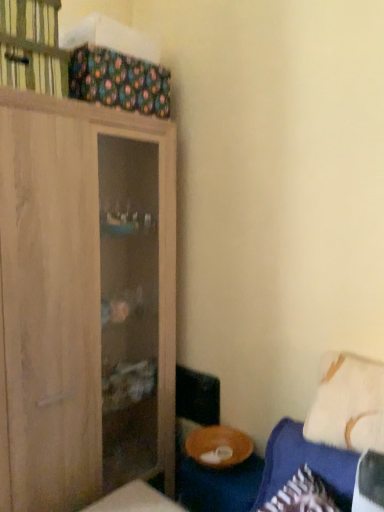
Question: Does white soft pillow at lower right have a greater width compared to wooden cabinet at upper left?

Choices:
 (A) yes
 (B) no

Answer: (B)

Question: Is white soft pillow at lower right positioned far away from wooden cabinet at upper left?

Choices:
 (A) yes
 (B) no

Answer: (A)

Question: Does white soft pillow at lower right have a lesser height compared to wooden cabinet at upper left?

Choices:
 (A) yes
 (B) no

Answer: (B)

Question: From a real-world perspective, is white soft pillow at lower right over wooden cabinet at upper left?

Choices:
 (A) yes
 (B) no

Answer: (B)

Question: Does white soft pillow at lower right appear on the left side of wooden cabinet at upper left?

Choices:
 (A) yes
 (B) no

Answer: (B)

Question: Considering their positions, is wooden cabinet at upper left located in front of or behind white soft pillow at lower right?

Choices:
 (A) behind
 (B) front

Answer: (A)

Question: Is wooden cabinet at upper left taller or shorter than white soft pillow at lower right?

Choices:
 (A) tall
 (B) short

Answer: (B)

Question: From the image's perspective, is wooden cabinet at upper left positioned above or below white soft pillow at lower right?

Choices:
 (A) above
 (B) below

Answer: (A)

Question: In terms of width, does wooden cabinet at upper left look wider or thinner when compared to white soft pillow at lower right?

Choices:
 (A) wide
 (B) thin

Answer: (A)

Question: Considering the relative positions of white soft pillow at lower right and light wood cabinet at left in the image provided, is white soft pillow at lower right to the left or to the right of light wood cabinet at left?

Choices:
 (A) left
 (B) right

Answer: (B)

Question: Considering the positions of white soft pillow at lower right and light wood cabinet at left in the image, is white soft pillow at lower right bigger or smaller than light wood cabinet at left?

Choices:
 (A) big
 (B) small

Answer: (B)

Question: Is point (344, 443) closer or farther from the camera than point (82, 480)?

Choices:
 (A) closer
 (B) farther

Answer: (A)

Question: Would you say white soft pillow at lower right is inside or outside light wood cabinet at left?

Choices:
 (A) outside
 (B) inside

Answer: (A)

Question: Is blue fabric couch at lower right wider or thinner than wooden bowl at lower right?

Choices:
 (A) thin
 (B) wide

Answer: (B)

Question: Relative to wooden bowl at lower right, is blue fabric couch at lower right in front or behind?

Choices:
 (A) front
 (B) behind

Answer: (A)